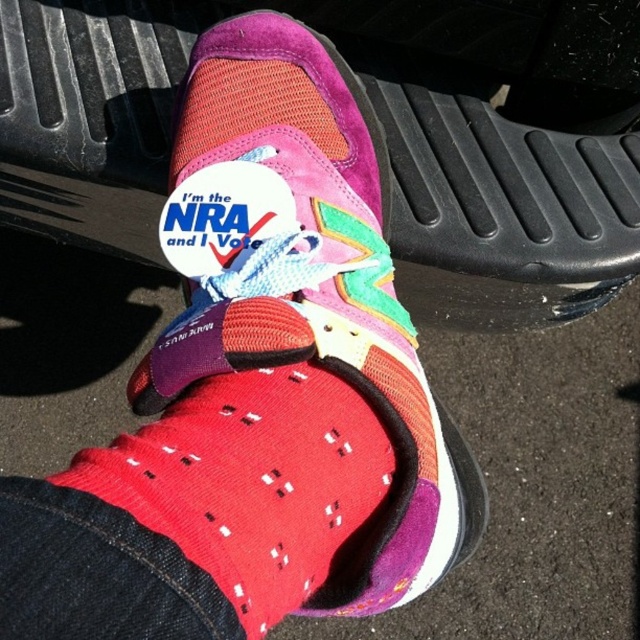
Can you confirm if suede/mesh sneaker at center is positioned above red knitted sock at lower center?

Correct, suede/mesh sneaker at center is located above red knitted sock at lower center.

Is suede/mesh sneaker at center wider than red knitted sock at lower center?

Yes, suede/mesh sneaker at center is wider than red knitted sock at lower center.

Where is `suede/mesh sneaker at center`? The image size is (640, 640). suede/mesh sneaker at center is located at coordinates (307, 349).

I want to click on suede/mesh sneaker at center, so click(x=307, y=349).